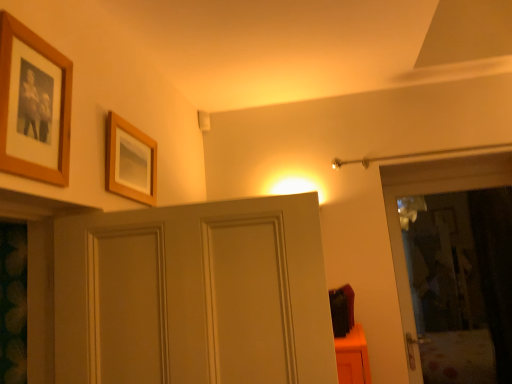
Question: From a real-world perspective, relative to wooden picture frame at upper center, the first picture frame in the back-to-front sequence, is wooden photo frame at upper left, placed as the 1th picture frame when sorted from left to right, vertically above or below?

Choices:
 (A) below
 (B) above

Answer: (B)

Question: Choose the correct answer: Is wooden photo frame at upper left, placed as the 1th picture frame when sorted from left to right, inside wooden picture frame at upper center, arranged as the 1th picture frame when viewed from the right, or outside it?

Choices:
 (A) inside
 (B) outside

Answer: (B)

Question: Relative to wooden picture frame at upper center, which is the second picture frame in left-to-right order, is wooden photo frame at upper left, arranged as the 1th picture frame when viewed from the front, in front or behind?

Choices:
 (A) front
 (B) behind

Answer: (A)

Question: Choose the correct answer: Is wooden picture frame at upper center, arranged as the 1th picture frame when viewed from the right, inside wooden photo frame at upper left, placed as the 1th picture frame when sorted from left to right, or outside it?

Choices:
 (A) inside
 (B) outside

Answer: (B)

Question: Considering the positions of wooden picture frame at upper center, which is the second picture frame in left-to-right order, and wooden photo frame at upper left, placed as the 2th picture frame when sorted from right to left, in the image, is wooden picture frame at upper center, which is the second picture frame in left-to-right order, taller or shorter than wooden photo frame at upper left, placed as the 2th picture frame when sorted from right to left,?

Choices:
 (A) short
 (B) tall

Answer: (A)

Question: Is point (117, 175) closer or farther from the camera than point (5, 135)?

Choices:
 (A) farther
 (B) closer

Answer: (A)

Question: Based on their sizes in the image, would you say wooden picture frame at upper center, the first picture frame in the back-to-front sequence, is bigger or smaller than wooden photo frame at upper left, placed as the 2th picture frame when sorted from right to left?

Choices:
 (A) small
 (B) big

Answer: (A)